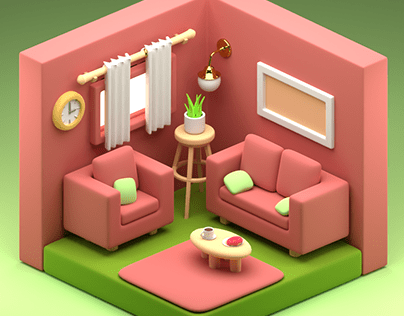
Locate an element on the screen. stool is located at coordinates (200, 141).